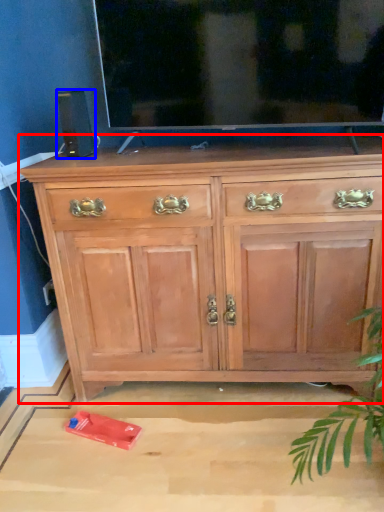
Question: Which of the following is the closest to the observer, chest of drawers (highlighted by a red box) or speaker (highlighted by a blue box)?

Choices:
 (A) chest of drawers
 (B) speaker

Answer: (A)